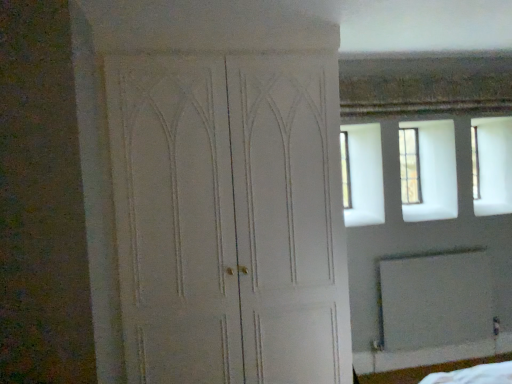
Question: Would you say white matte screen door at lower right is outside clear glass window at upper right?

Choices:
 (A) yes
 (B) no

Answer: (A)

Question: Is white matte screen door at lower right to the right of clear glass window at upper right from the viewer's perspective?

Choices:
 (A) yes
 (B) no

Answer: (A)

Question: From the image's perspective, is white matte screen door at lower right beneath clear glass window at upper right?

Choices:
 (A) no
 (B) yes

Answer: (B)

Question: From the image's perspective, is white matte screen door at lower right on top of clear glass window at upper right?

Choices:
 (A) no
 (B) yes

Answer: (A)

Question: Is white matte screen door at lower right thinner than clear glass window at upper right?

Choices:
 (A) yes
 (B) no

Answer: (B)

Question: Is clear glass window at upper right inside or outside of white matte door at center?

Choices:
 (A) outside
 (B) inside

Answer: (A)

Question: Considering the positions of clear glass window at upper right and white matte door at center in the image, is clear glass window at upper right bigger or smaller than white matte door at center?

Choices:
 (A) big
 (B) small

Answer: (B)

Question: Looking at their shapes, would you say clear glass window at upper right is wider or thinner than white matte door at center?

Choices:
 (A) wide
 (B) thin

Answer: (B)

Question: From the image's perspective, is clear glass window at upper right located above or below white matte door at center?

Choices:
 (A) below
 (B) above

Answer: (B)

Question: Considering the relative positions of white matte screen door at lower right and clear glass window at upper right in the image provided, is white matte screen door at lower right to the left or to the right of clear glass window at upper right?

Choices:
 (A) left
 (B) right

Answer: (B)

Question: Choose the correct answer: Is white matte screen door at lower right inside clear glass window at upper right or outside it?

Choices:
 (A) inside
 (B) outside

Answer: (B)

Question: From a real-world perspective, is white matte screen door at lower right positioned above or below clear glass window at upper right?

Choices:
 (A) above
 (B) below

Answer: (B)

Question: Does point (437, 326) appear closer or farther from the camera than point (410, 185)?

Choices:
 (A) closer
 (B) farther

Answer: (A)

Question: Looking at their shapes, would you say white matte door at center is wider or thinner than white matte screen door at lower right?

Choices:
 (A) wide
 (B) thin

Answer: (A)

Question: In the image, is white matte door at center positioned in front of or behind white matte screen door at lower right?

Choices:
 (A) behind
 (B) front

Answer: (B)